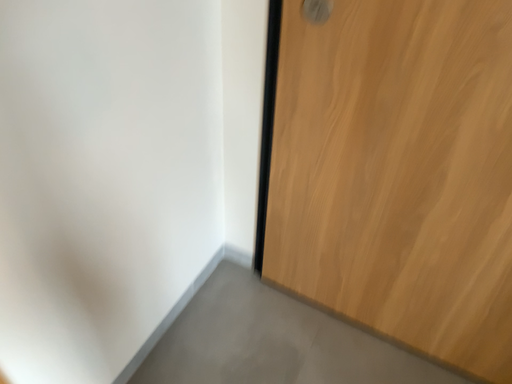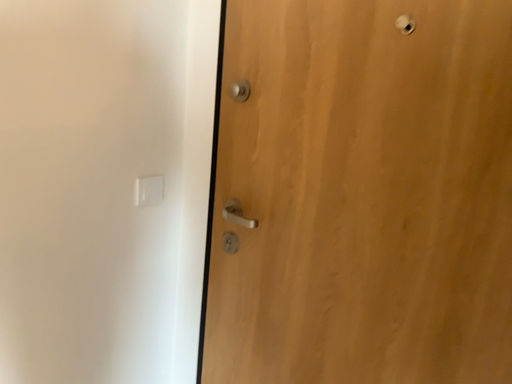
Question: How did the camera likely rotate when shooting the video?

Choices:
 (A) rotated right
 (B) rotated left

Answer: (B)